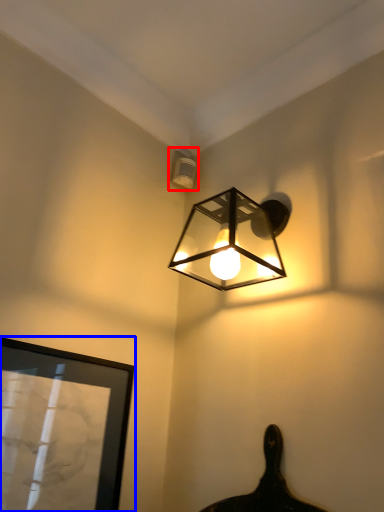
Question: Which object is closer to the camera taking this photo, lamp (highlighted by a red box) or picture frame (highlighted by a blue box)?

Choices:
 (A) lamp
 (B) picture frame

Answer: (B)